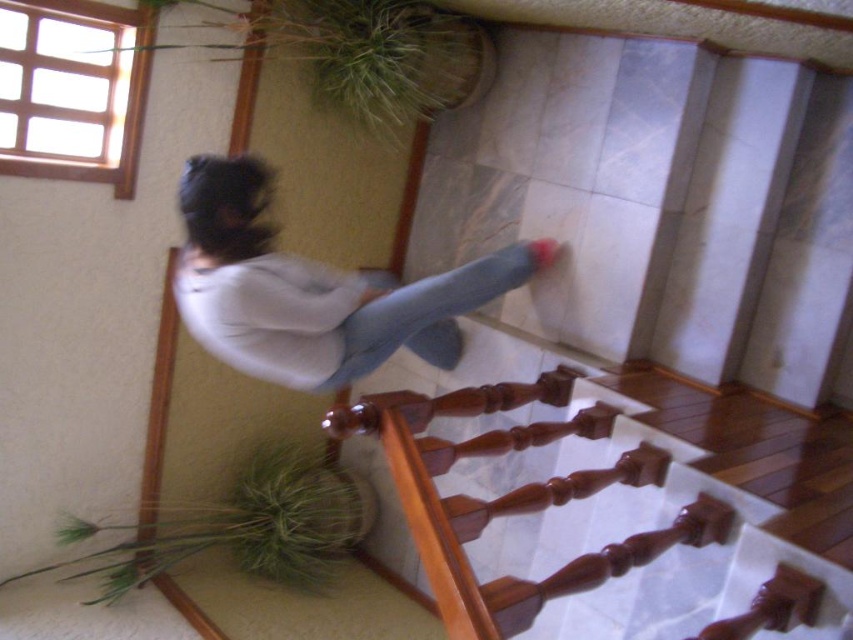
Question: Can you confirm if wooden staircase at center is positioned below light blue denim jeans at center?

Choices:
 (A) yes
 (B) no

Answer: (A)

Question: Among these points, which one is nearest to the camera?

Choices:
 (A) click(x=798, y=616)
 (B) click(x=453, y=305)

Answer: (A)

Question: Is wooden staircase at center above light blue denim jeans at center?

Choices:
 (A) no
 (B) yes

Answer: (A)

Question: Considering the relative positions of wooden staircase at center and light blue denim jeans at center in the image provided, where is wooden staircase at center located with respect to light blue denim jeans at center?

Choices:
 (A) right
 (B) left

Answer: (A)